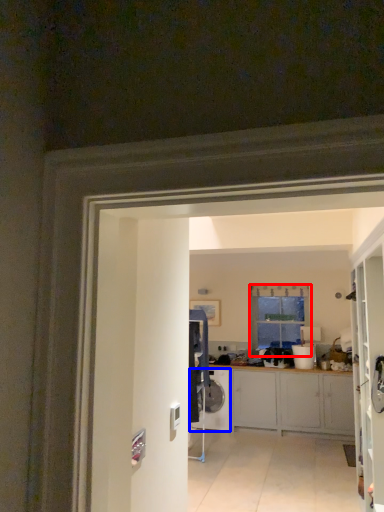
Question: Which point is further to the camera, window (highlighted by a red box) or washing machine (highlighted by a blue box)?

Choices:
 (A) window
 (B) washing machine

Answer: (A)